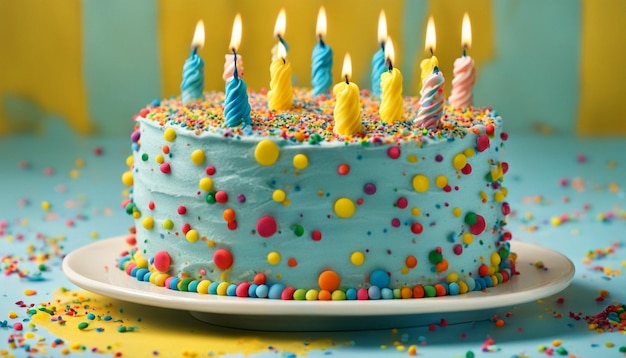
Find the location of `blue birthday candles`. blue birthday candles is located at coordinates 187,79, 227,109, 319,60, 379,62.